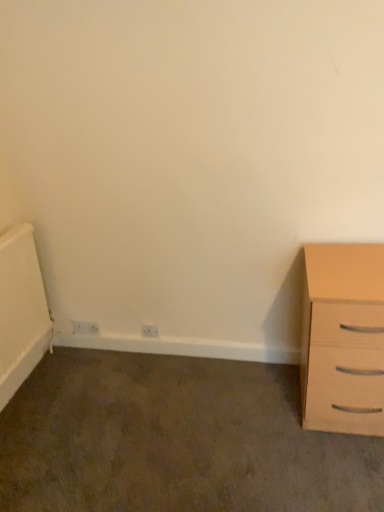
Question: Is white plastic electric outlet at lower center, arranged as the first electric outlet when viewed from the front, facing towards light wood chest of drawers at right?

Choices:
 (A) yes
 (B) no

Answer: (B)

Question: Can you confirm if white plastic electric outlet at lower center, which is counted as the 2th electric outlet, starting from the left, is smaller than light wood chest of drawers at right?

Choices:
 (A) no
 (B) yes

Answer: (B)

Question: From a real-world perspective, is white plastic electric outlet at lower center, which is counted as the first electric outlet, starting from the right, located beneath light wood chest of drawers at right?

Choices:
 (A) no
 (B) yes

Answer: (B)

Question: Is white plastic electric outlet at lower center, which is counted as the 2th electric outlet, starting from the left, not close to light wood chest of drawers at right?

Choices:
 (A) yes
 (B) no

Answer: (A)

Question: Is white plastic electric outlet at lower center, which is counted as the first electric outlet, starting from the right, wider than light wood chest of drawers at right?

Choices:
 (A) no
 (B) yes

Answer: (A)

Question: From the image's perspective, would you say white plastic electric outlet at lower center, which is counted as the first electric outlet, starting from the right, is positioned over light wood chest of drawers at right?

Choices:
 (A) yes
 (B) no

Answer: (B)

Question: Can you confirm if white plastic electric outlet at lower left, which is the first electric outlet in back-to-front order, is wider than light wood chest of drawers at right?

Choices:
 (A) no
 (B) yes

Answer: (A)

Question: From the image's perspective, is white plastic electric outlet at lower left, which ranks as the first electric outlet in left-to-right order, on light wood chest of drawers at right?

Choices:
 (A) no
 (B) yes

Answer: (A)

Question: Is white plastic electric outlet at lower left, which ranks as the first electric outlet in left-to-right order, not near light wood chest of drawers at right?

Choices:
 (A) no
 (B) yes

Answer: (B)

Question: Is white plastic electric outlet at lower left, which ranks as the 2th electric outlet in right-to-left order, smaller than light wood chest of drawers at right?

Choices:
 (A) no
 (B) yes

Answer: (B)

Question: Does white plastic electric outlet at lower left, the 2th electric outlet in the front-to-back sequence, appear on the left side of light wood chest of drawers at right?

Choices:
 (A) no
 (B) yes

Answer: (B)

Question: Is light wood chest of drawers at right a part of white plastic electric outlet at lower left, which ranks as the 2th electric outlet in right-to-left order?

Choices:
 (A) no
 (B) yes

Answer: (A)

Question: From the image's perspective, is light wood chest of drawers at right beneath white plastic electric outlet at lower left, which is the first electric outlet in back-to-front order?

Choices:
 (A) no
 (B) yes

Answer: (A)